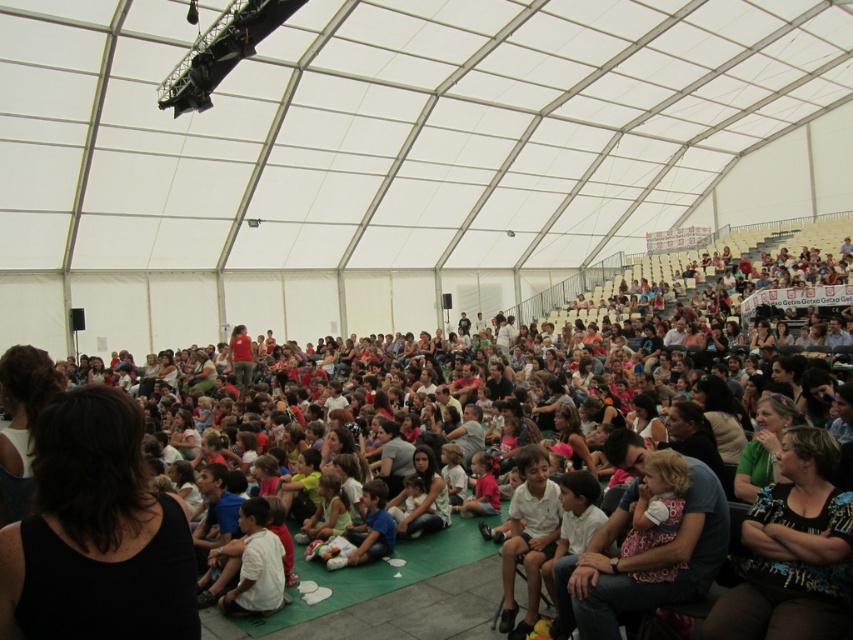
Is light brown fabric shirt at lower center closer to camera compared to pink matte shirt at lower center?

Yes, it is.

Is point (329, 492) farther from viewer compared to point (489, 497)?

No, it is not.

Describe the element at coordinates (326, 512) in the screenshot. This screenshot has height=640, width=853. I see `light brown fabric shirt at lower center` at that location.

I want to click on light brown fabric shirt at lower center, so click(326, 512).

Can you confirm if black printed shirt at lower right is thinner than matte red shirt at center?

No.

Does black printed shirt at lower right appear under matte red shirt at center?

Correct, black printed shirt at lower right is located below matte red shirt at center.

This screenshot has height=640, width=853. Describe the element at coordinates (793, 552) in the screenshot. I see `black printed shirt at lower right` at that location.

The image size is (853, 640). I want to click on black printed shirt at lower right, so click(793, 552).

Between black printed shirt at lower right and pink matte shirt at lower center, which one is positioned higher?

Positioned higher is black printed shirt at lower right.

Is black printed shirt at lower right below pink matte shirt at lower center?

Incorrect, black printed shirt at lower right is not positioned below pink matte shirt at lower center.

The height and width of the screenshot is (640, 853). Identify the location of black printed shirt at lower right. (793, 552).